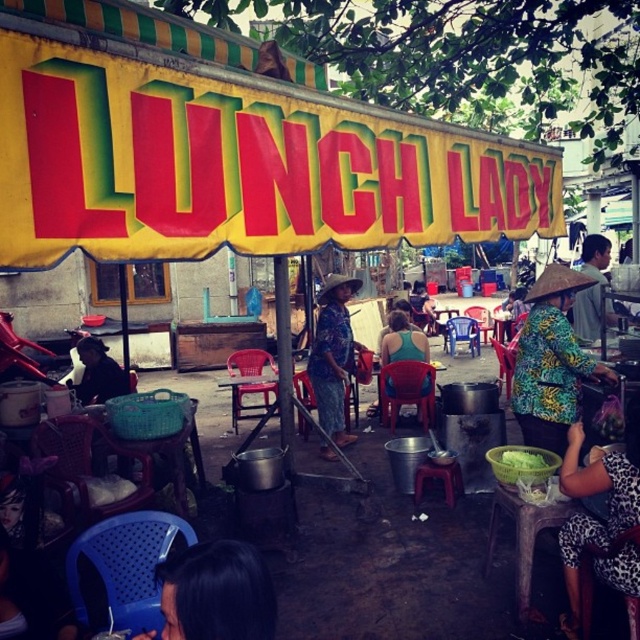
You are standing at the entrance of the LUNCH LADY food stall and want to find the printed fabric skirt at center. Based on the coordinates provided, can you determine its exact position relative to the stall entrance?

The printed fabric skirt at center is located at coordinates point (332,355), which is centrally positioned within the stall area. Since the entrance is typically at the front, the skirt is likely positioned towards the central part of the stall, away from the entrance.